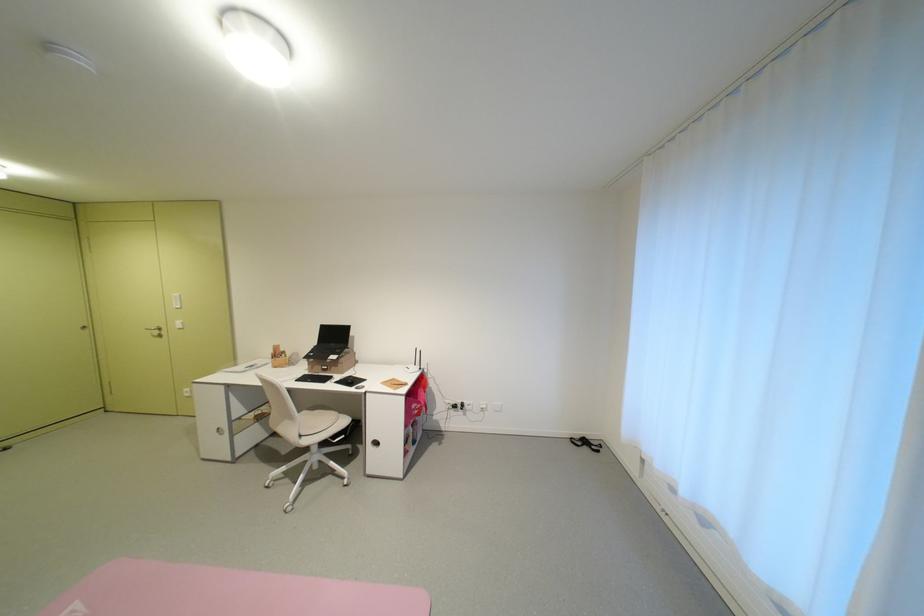
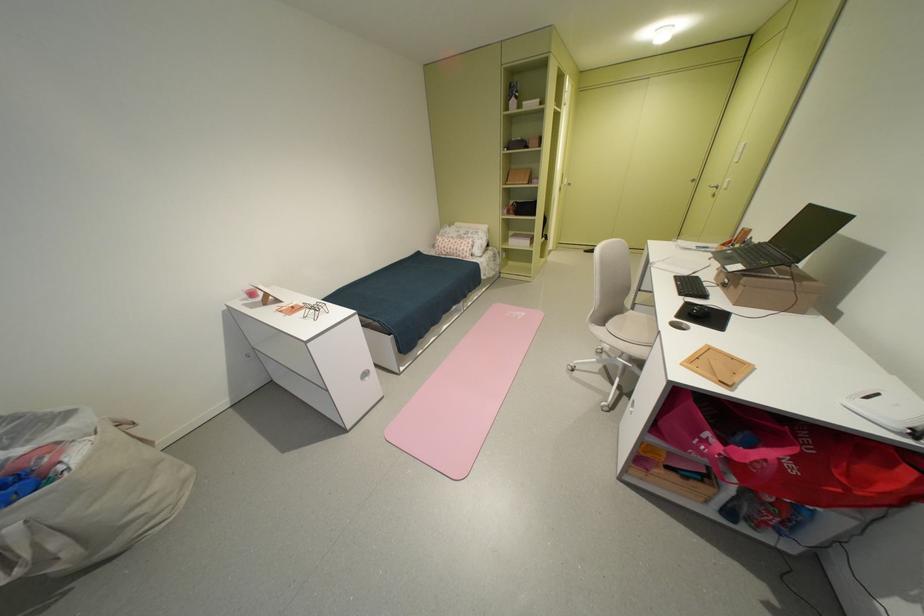
Locate, in the second image, the point that corresponds to the point at 311,436 in the first image.

(615, 326)